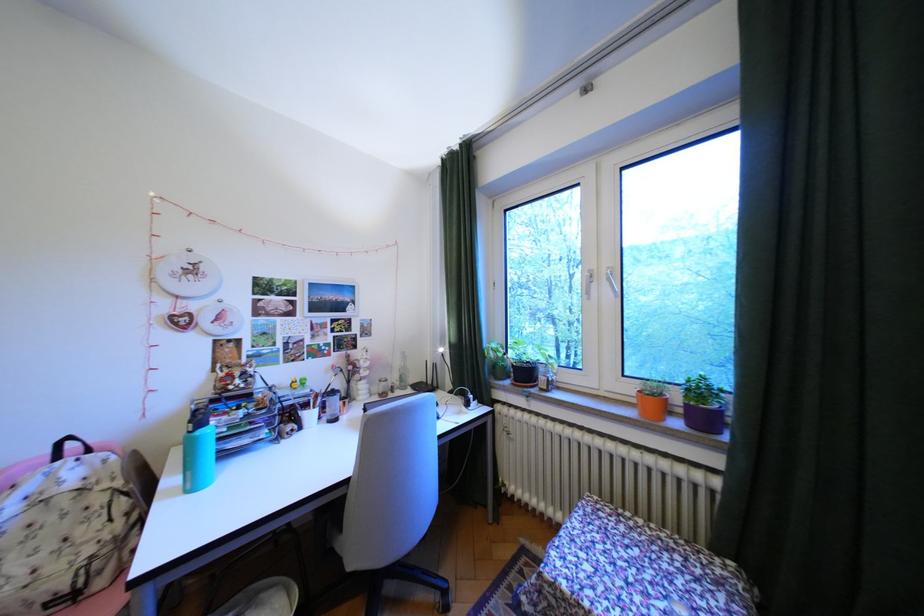
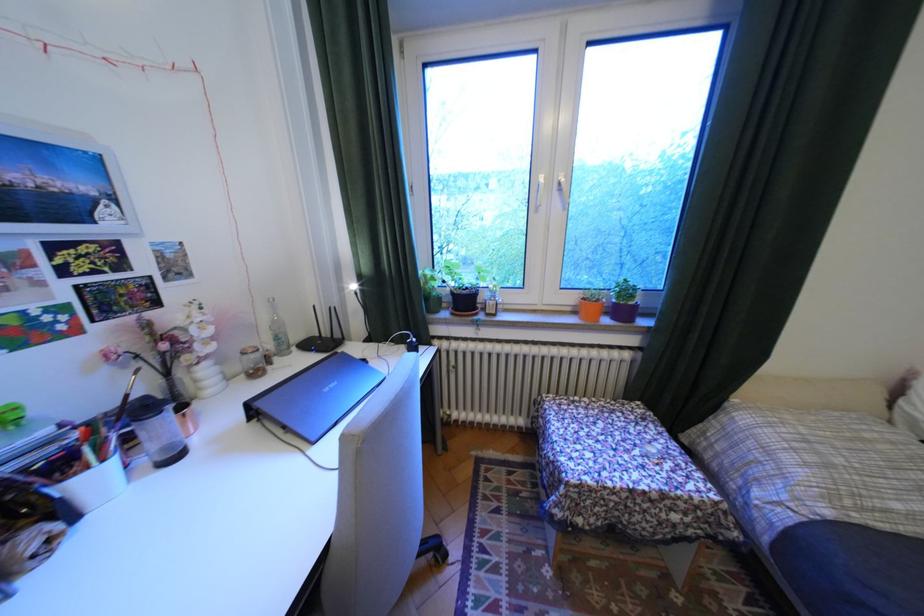
Based on the continuous images, in which direction is the camera rotating?

The camera's rotation is toward right-down.